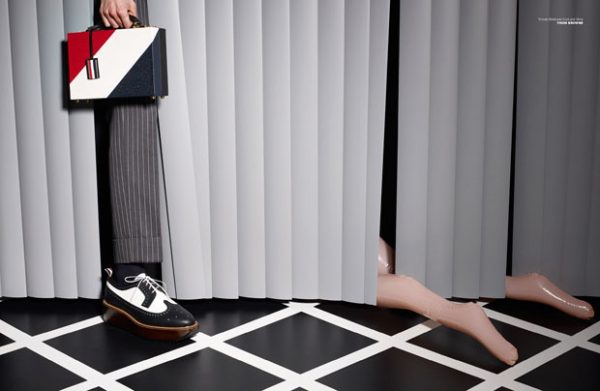
This screenshot has width=600, height=391. I want to click on floor, so click(300, 350).